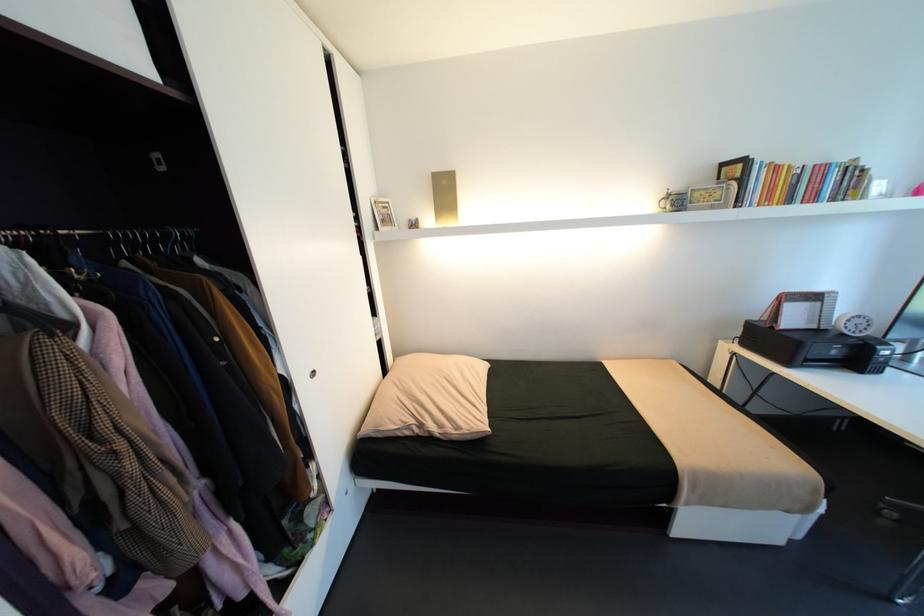
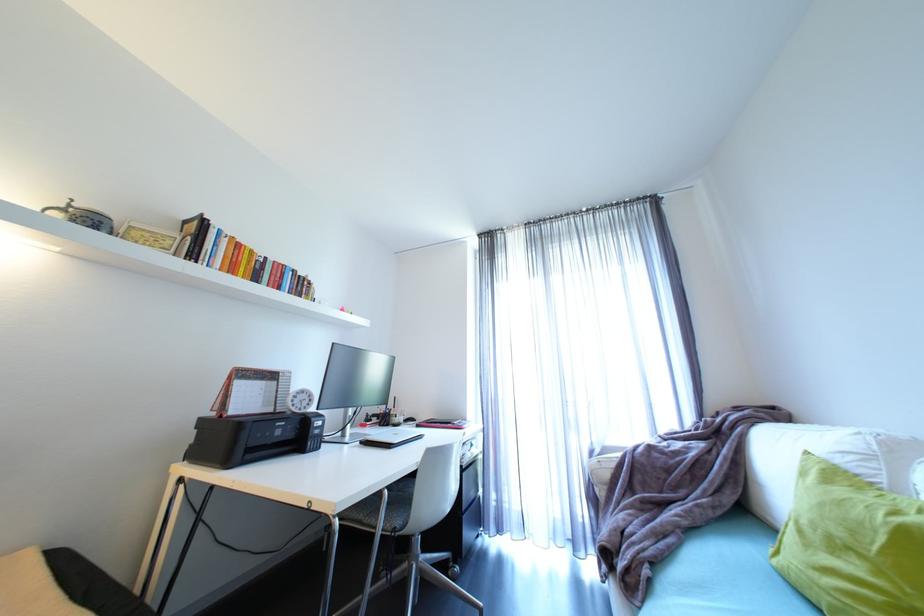
In the second image, find the point that corresponds to pixel 672 196 in the first image.

(69, 206)